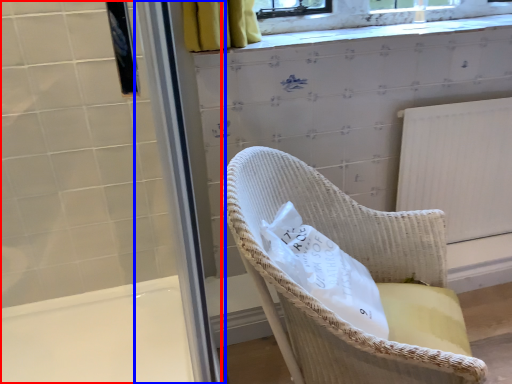
Question: Among these objects, which one is farthest to the camera, screen door (highlighted by a red box) or screen door (highlighted by a blue box)?

Choices:
 (A) screen door
 (B) screen door

Answer: (A)